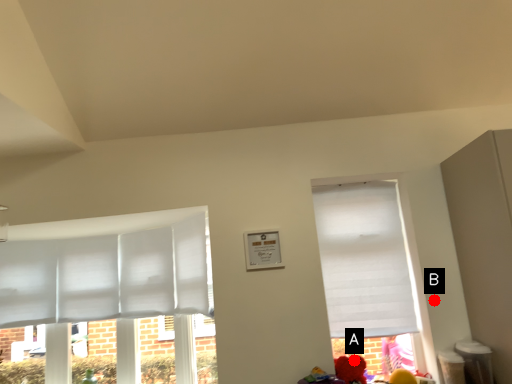
Question: Two points are circled on the image, labeled by A and B beside each circle. Which point is closer to the camera taking this photo?

Choices:
 (A) A is closer
 (B) B is closer

Answer: (A)